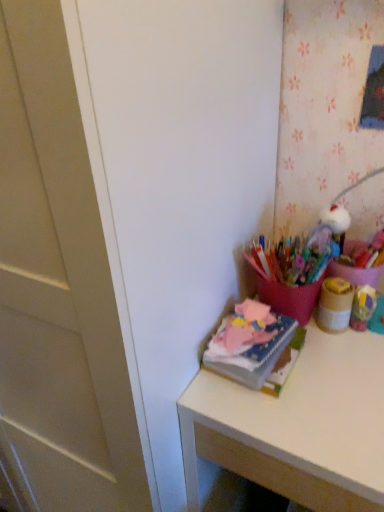
You are a GUI agent. You are given a task and a screenshot of the screen. Output one action in this format:
    pyautogui.click(x=<x>, y=<y>)
    Task: Click on the free spot in front of matte brown jar at upper right
    This screenshot has height=512, width=384.
    Given the screenshot: What is the action you would take?
    pyautogui.click(x=339, y=380)